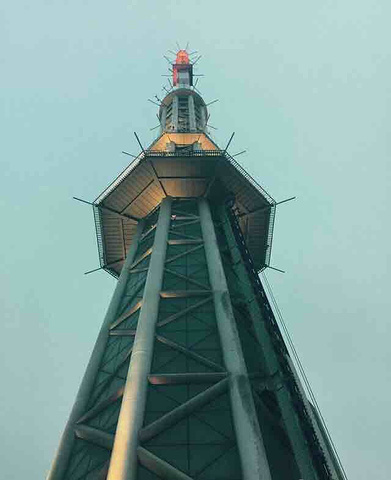
Where is `horizontal pipe`? The width and height of the screenshot is (391, 480). horizontal pipe is located at coordinates (181, 292).